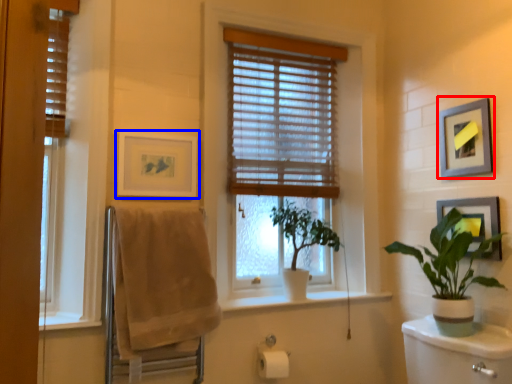
Question: Which of the following is the farthest to the observer, picture frame (highlighted by a red box) or picture frame (highlighted by a blue box)?

Choices:
 (A) picture frame
 (B) picture frame

Answer: (B)